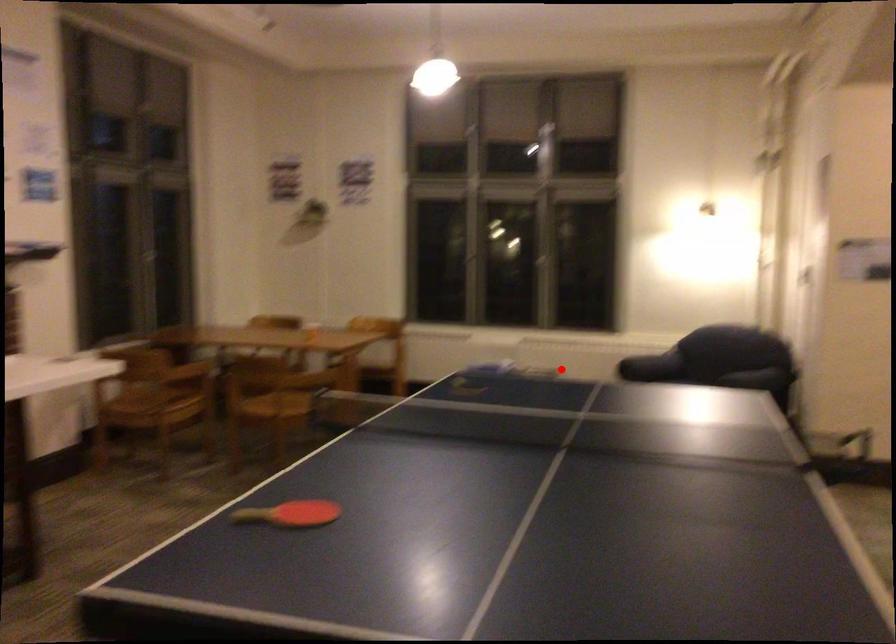
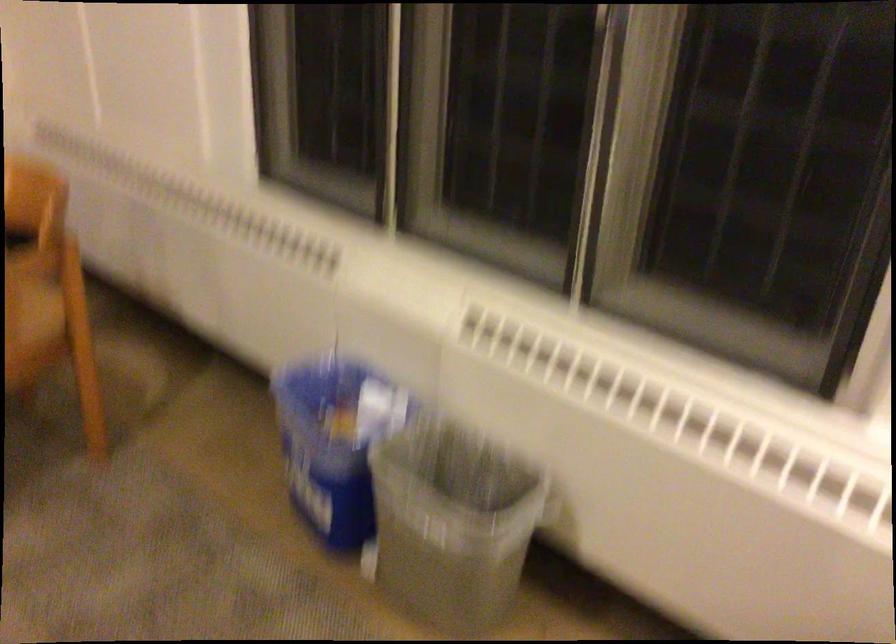
Question: A red point is marked in image1. In image2, is the corresponding 3D point closer to the camera or farther? Reply with the corresponding letter.

Choices:
 (A) The corresponding 3D point is closer.
 (B) The corresponding 3D point is farther.

Answer: (A)